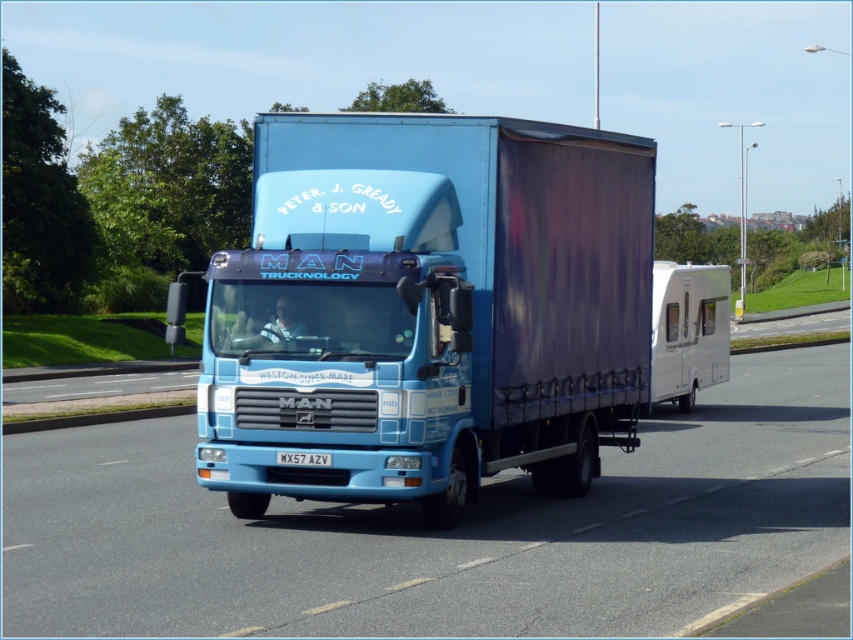
Which of these two, white glossy caravan at right or white plastic license plate at center, stands taller?

Standing taller between the two is white glossy caravan at right.

Does point (700, 324) come in front of point (288, 458)?

No, it is behind (288, 458).

Identify the location of white glossy caravan at right. The height and width of the screenshot is (640, 853). point(688,330).

Is point (201, 560) positioned before point (323, 460)?

That is True.

The width and height of the screenshot is (853, 640). Describe the element at coordinates (438, 531) in the screenshot. I see `blue glossy truck at center` at that location.

This screenshot has width=853, height=640. Find the location of `blue glossy truck at center`. blue glossy truck at center is located at coordinates (438, 531).

Between blue glossy trailer truck at center and blue glossy truck at center, which one is positioned higher?

blue glossy trailer truck at center

Who is more forward, (641, 314) or (537, 540)?

Positioned in front is point (537, 540).

At what (x,y) coordinates should I click in order to perform the action: click on blue glossy trailer truck at center. Please return your answer as a coordinate pair (x, y). Image resolution: width=853 pixels, height=640 pixels. Looking at the image, I should click on (427, 308).